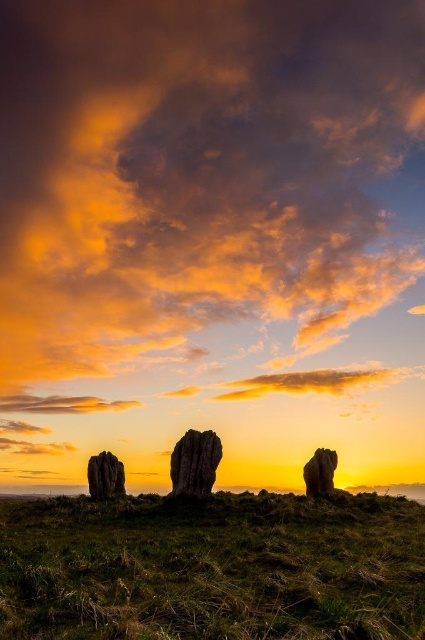
You are standing at the base of the hill where the green grassy at lower center and smooth stone rock at right are located. If you look down towards the ground, which object would you see first?

The smooth stone rock at right would be seen first because it is positioned below the green grassy at lower center.

You are a photographer positioned at the base of the hill where the smooth gray rock at left and the smooth stone rock at right are located. You want to capture a photo where both rocks are visible in the frame. Based on their positions, which rock should you focus on first to ensure both are in the shot?

The smooth gray rock at left is below the smooth stone rock at right, so focusing on the lower smooth gray rock at left first will allow you to frame the shot to include both rocks in the image.

You are standing at the center of the grassy hilltop where the three stone structures are located. You want to place a small flag exactly at the coordinates mentioned for the smooth gray rock at left. What are the coordinates where you should place the flag?

You should place the flag at coordinates point (104, 476) where the smooth gray rock at left is located.